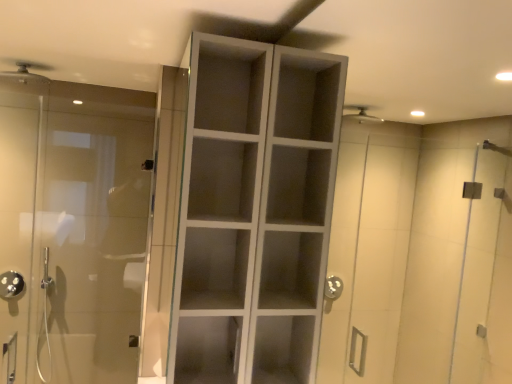
Locate an element on the screen. matte silver shower head at upper left, the 1th shower from the right is located at coordinates (26, 72).

From a real-world perspective, which object rests below the other?

From a 3D spatial view, transparent glass door at left is below.

Considering the sizes of objects white matte cabinet at center and transparent glass door at left in the image provided, who is smaller, white matte cabinet at center or transparent glass door at left?

With smaller size is transparent glass door at left.

Can you tell me how much white matte cabinet at center and transparent glass door at left differ in facing direction?

The facing directions of white matte cabinet at center and transparent glass door at left are 89 degrees apart.

Could you tell me if white matte cabinet at center is turned towards transparent glass door at left?

Yes, white matte cabinet at center is oriented towards transparent glass door at left.

Does polished chrome showerhead at left, arranged as the second shower when viewed from the right, appear on the right side of transparent glass door at left?

No, polished chrome showerhead at left, arranged as the second shower when viewed from the right, is not to the right of transparent glass door at left.

Is the position of polished chrome showerhead at left, arranged as the second shower when viewed from the right, less distant than that of transparent glass door at left?

No, it is behind transparent glass door at left.

Considering the points (16, 286) and (89, 147), which point is behind, point (16, 286) or point (89, 147)?

The point (89, 147) is farther.

Can you confirm if polished chrome showerhead at left, arranged as the second shower when viewed from the right, is smaller than transparent glass door at left?

Indeed, polished chrome showerhead at left, arranged as the second shower when viewed from the right, has a smaller size compared to transparent glass door at left.

Which object is further away from the camera, matte silver shower head at upper left, acting as the 2th shower starting from the bottom, or polished chrome showerhead at left, which is the first shower from left to right?

Positioned behind is polished chrome showerhead at left, which is the first shower from left to right.

Is matte silver shower head at upper left, placed as the 1th shower when sorted from top to bottom, situated inside polished chrome showerhead at left, which is the first shower from left to right, or outside?

matte silver shower head at upper left, placed as the 1th shower when sorted from top to bottom, cannot be found inside polished chrome showerhead at left, which is the first shower from left to right.

Can you see matte silver shower head at upper left, placed as the second shower when sorted from back to front, touching polished chrome showerhead at left, acting as the 1th shower starting from the bottom?

They are not placed beside each other.

Can you confirm if matte silver shower head at upper left, the 1th shower from the right, is taller than polished chrome showerhead at left, arranged as the second shower when viewed from the right?

Incorrect, the height of matte silver shower head at upper left, the 1th shower from the right, is not larger of that of polished chrome showerhead at left, arranged as the second shower when viewed from the right.

Is white matte cabinet at center far from matte silver shower head at upper left, which is counted as the first shower, starting from the front?

white matte cabinet at center is far away from matte silver shower head at upper left, which is counted as the first shower, starting from the front.

The image size is (512, 384). I want to click on cupboard on the right side of matte silver shower head at upper left, the 1th shower from the right, so click(254, 212).

Could you tell me if white matte cabinet at center is turned towards matte silver shower head at upper left, which is counted as the first shower, starting from the front?

No, white matte cabinet at center is not facing towards matte silver shower head at upper left, which is counted as the first shower, starting from the front.

Considering the positions of objects white matte cabinet at center and matte silver shower head at upper left, placed as the 1th shower when sorted from top to bottom, in the image provided, who is more to the left, white matte cabinet at center or matte silver shower head at upper left, placed as the 1th shower when sorted from top to bottom,?

matte silver shower head at upper left, placed as the 1th shower when sorted from top to bottom, is more to the left.

Is transparent glass door at left taller than matte silver shower head at upper left, the 1th shower from the right?

Yes.

From the transparent glass door at left, count the 1st shower to the left and point to it. Please provide its 2D coordinates.

[(26, 72)]

Considering the relative sizes of transparent glass door at left and matte silver shower head at upper left, the 1th shower from the right, in the image provided, is transparent glass door at left wider than matte silver shower head at upper left, the 1th shower from the right,?

No.

Based on the photo, is transparent glass door at left positioned far away from matte silver shower head at upper left, placed as the 1th shower when sorted from top to bottom?

No.

Is matte silver shower head at upper left, which is counted as the first shower, starting from the front, completely or partially outside of transparent glass door at left?

Yes, matte silver shower head at upper left, which is counted as the first shower, starting from the front, is outside of transparent glass door at left.

In terms of width, does matte silver shower head at upper left, the 1th shower from the right, look wider or thinner when compared to transparent glass door at left?

matte silver shower head at upper left, the 1th shower from the right, is wider than transparent glass door at left.

Is matte silver shower head at upper left, which is the second shower in left-to-right order, facing away from transparent glass door at left?

No.

Is matte silver shower head at upper left, which is the second shower in left-to-right order, further to the viewer compared to transparent glass door at left?

Yes, matte silver shower head at upper left, which is the second shower in left-to-right order, is further from the camera.

Does point (98, 327) appear closer or farther from the camera than point (8, 274)?

Clearly, point (98, 327) is more distant from the camera than point (8, 274).

I want to click on shower that is the 2nd object to the left of the transparent glass door at left, starting at the anchor, so click(11, 284).

How different are the orientations of transparent glass door at left and polished chrome showerhead at left, acting as the 1th shower starting from the bottom, in degrees?

1.98 degrees separate the facing orientations of transparent glass door at left and polished chrome showerhead at left, acting as the 1th shower starting from the bottom.

From the image's perspective, is transparent glass door at left above polished chrome showerhead at left, the second shower viewed from the top?

Yes, from the image's perspective, transparent glass door at left is above polished chrome showerhead at left, the second shower viewed from the top.

Where is `cupboard located in front of the transparent glass door at left`? cupboard located in front of the transparent glass door at left is located at coordinates (254, 212).

The width and height of the screenshot is (512, 384). I want to click on door that appears above the polished chrome showerhead at left, which appears as the first shower when viewed from the back (from the image's perspective), so click(x=93, y=245).

Considering their positions, is transparent glass door at left positioned further to polished chrome showerhead at left, which is the first shower from left to right, than white matte cabinet at center?

white matte cabinet at center lies further to polished chrome showerhead at left, which is the first shower from left to right, than the other object.

From the image, which object appears to be farther from white matte cabinet at center, polished chrome showerhead at left, which is the first shower from left to right, or transparent glass door at left?

The object further to white matte cabinet at center is polished chrome showerhead at left, which is the first shower from left to right.

Estimate the real-world distances between objects in this image. Which object is further from matte silver shower head at upper left, the 1th shower from the right, transparent glass door at left or polished chrome showerhead at left, which appears as the first shower when viewed from the back?

Among the two, polished chrome showerhead at left, which appears as the first shower when viewed from the back, is located further to matte silver shower head at upper left, the 1th shower from the right.

When comparing their distances from transparent glass door at left, does matte silver shower head at upper left, acting as the 2th shower starting from the bottom, or polished chrome showerhead at left, which appears as the first shower when viewed from the back, seem closer?

The object closer to transparent glass door at left is polished chrome showerhead at left, which appears as the first shower when viewed from the back.

Which object lies nearer to the anchor point polished chrome showerhead at left, the second shower viewed from the top, white matte cabinet at center or matte silver shower head at upper left, acting as the 2th shower starting from the bottom?

Among the two, matte silver shower head at upper left, acting as the 2th shower starting from the bottom, is located nearer to polished chrome showerhead at left, the second shower viewed from the top.

Looking at this image, when comparing their distances from white matte cabinet at center, does polished chrome showerhead at left, the second shower viewed from the top, or matte silver shower head at upper left, acting as the 2th shower starting from the bottom, seem further?

polished chrome showerhead at left, the second shower viewed from the top, is positioned further to the anchor white matte cabinet at center.

Based on their spatial positions, is transparent glass door at left or white matte cabinet at center closer to matte silver shower head at upper left, which is counted as the first shower, starting from the front?

Among the two, transparent glass door at left is located nearer to matte silver shower head at upper left, which is counted as the first shower, starting from the front.

Based on their spatial positions, is polished chrome showerhead at left, acting as the 1th shower starting from the bottom, or white matte cabinet at center closer to transparent glass door at left?

Among the two, polished chrome showerhead at left, acting as the 1th shower starting from the bottom, is located nearer to transparent glass door at left.

This screenshot has height=384, width=512. What are the coordinates of `shower between white matte cabinet at center and polished chrome showerhead at left, which appears as the first shower when viewed from the back, along the z-axis` in the screenshot? It's located at (26, 72).

In order to click on door between matte silver shower head at upper left, placed as the second shower when sorted from back to front, and white matte cabinet at center, in the horizontal direction in this screenshot , I will do `click(93, 245)`.

This screenshot has height=384, width=512. Find the location of `door located between white matte cabinet at center and polished chrome showerhead at left, which is the first shower from left to right, in the depth direction`. door located between white matte cabinet at center and polished chrome showerhead at left, which is the first shower from left to right, in the depth direction is located at coordinates (93, 245).

The width and height of the screenshot is (512, 384). Find the location of `door that lies between matte silver shower head at upper left, placed as the 1th shower when sorted from top to bottom, and polished chrome showerhead at left, which appears as the first shower when viewed from the back, from top to bottom`. door that lies between matte silver shower head at upper left, placed as the 1th shower when sorted from top to bottom, and polished chrome showerhead at left, which appears as the first shower when viewed from the back, from top to bottom is located at coordinates (93, 245).